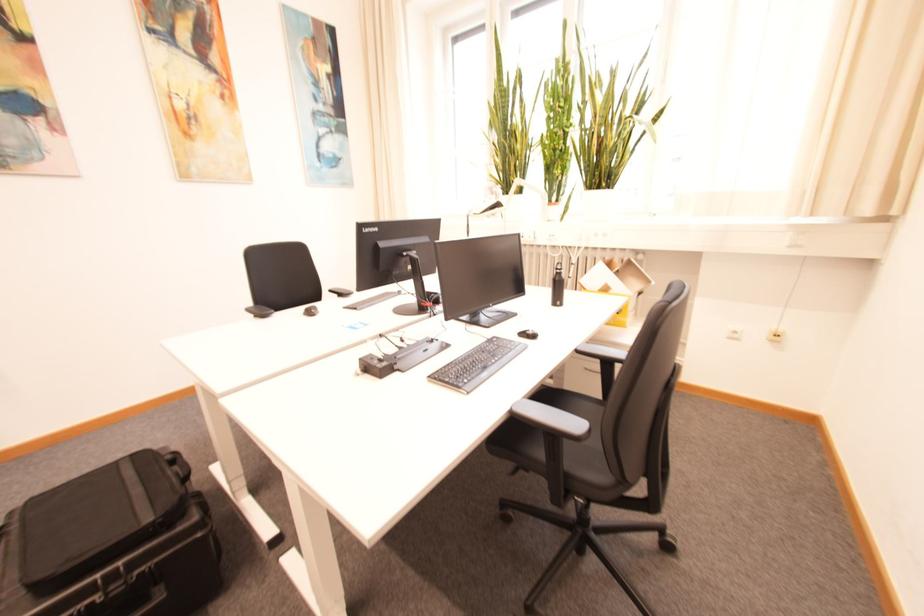
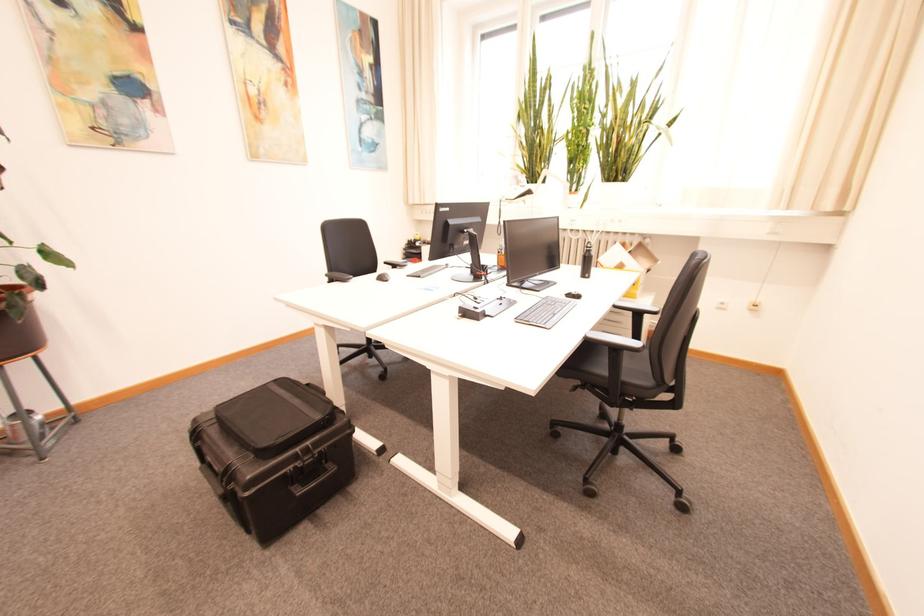
Where in the second image is the point corresponding to [317,313] from the first image?

(388, 280)